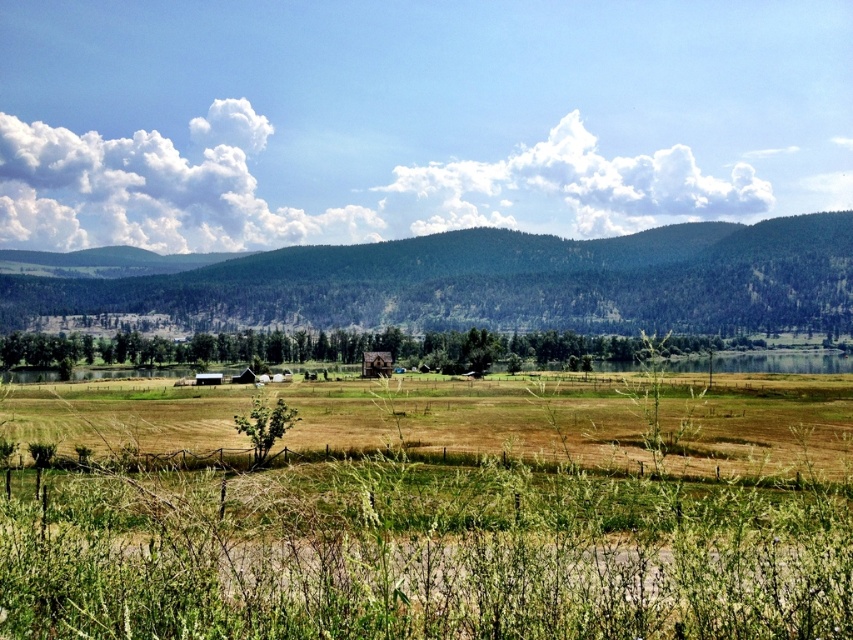
Question: Estimate the real-world distances between objects in this image. Which object is closer to the brown wooden hut at center?

Choices:
 (A) green grass at center
 (B) green forested mountain at center

Answer: (B)

Question: Can you confirm if green grass at center is thinner than brown wooden hut at center?

Choices:
 (A) yes
 (B) no

Answer: (B)

Question: Which point is closer to the camera?

Choices:
 (A) (386, 358)
 (B) (28, 317)
 (C) (286, 625)

Answer: (C)

Question: Does green forested mountain at center appear on the right side of brown wooden hut at center?

Choices:
 (A) yes
 (B) no

Answer: (A)

Question: Does green grass at center have a lesser width compared to green forested mountain at center?

Choices:
 (A) yes
 (B) no

Answer: (A)

Question: Considering the real-world distances, which object is farthest from the green forested mountain at center?

Choices:
 (A) green grass at center
 (B) brown wooden hut at center

Answer: (A)